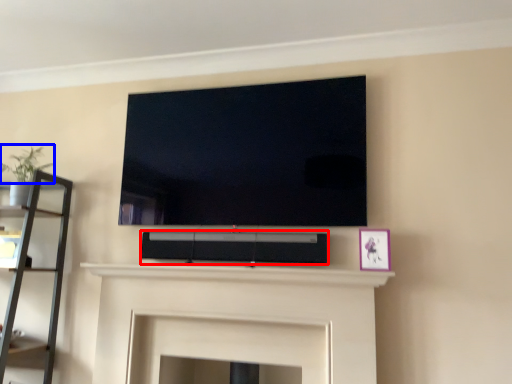
Question: Which point is closer to the camera, speaker (highlighted by a red box) or plant (highlighted by a blue box)?

Choices:
 (A) speaker
 (B) plant

Answer: (A)